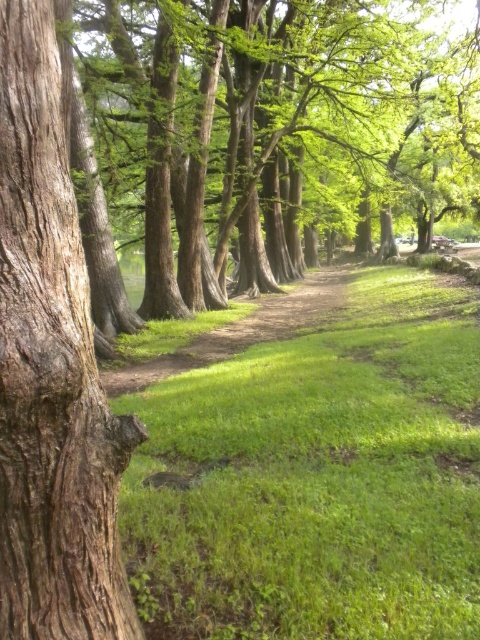
Question: Which object is positioned closest to the dirt path at center?

Choices:
 (A) brown rough bark tree trunk at left
 (B) green grassy at center
 (C) green rough bark tree at center

Answer: (B)

Question: Which object is positioned farthest from the brown rough bark tree trunk at left?

Choices:
 (A) green rough bark tree at center
 (B) dirt path at center
 (C) green grassy at center

Answer: (A)

Question: Can you confirm if green rough bark tree at center is thinner than brown rough bark tree trunk at left?

Choices:
 (A) no
 (B) yes

Answer: (A)

Question: Can you confirm if green grassy at center is thinner than dirt path at center?

Choices:
 (A) yes
 (B) no

Answer: (A)

Question: Which point is closer to the camera?

Choices:
 (A) dirt path at center
 (B) green grassy at center
 (C) brown rough bark tree trunk at left

Answer: (C)

Question: Is green rough bark tree at center to the right of dirt path at center from the viewer's perspective?

Choices:
 (A) yes
 (B) no

Answer: (A)